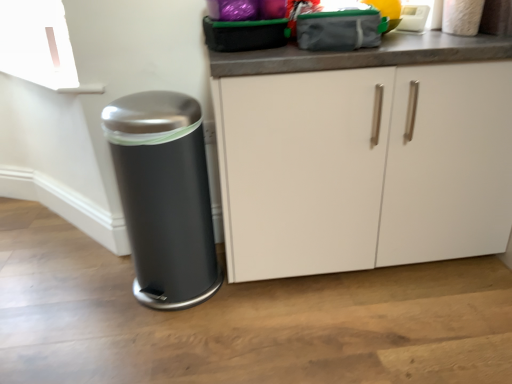
Question: From a real-world perspective, is white plastic appliance at upper right physically located above or below white matte cabinet at center?

Choices:
 (A) below
 (B) above

Answer: (B)

Question: Based on their positions, is white plastic appliance at upper right located to the left or right of white matte cabinet at center?

Choices:
 (A) left
 (B) right

Answer: (B)

Question: Estimate the real-world distances between objects in this image. Which object is farther from the satin black trash can at lower left?

Choices:
 (A) white matte cabinet at center
 (B) white plastic appliance at upper right

Answer: (B)

Question: Which is farther from the white matte cabinet at center?

Choices:
 (A) white plastic appliance at upper right
 (B) satin black trash can at lower left

Answer: (A)